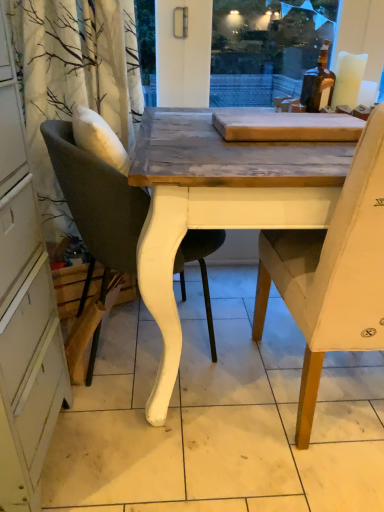
Question: From the image's perspective, is light beige fabric chair at right, which is the first chair from right to left, above or below matte gray cushioned chair at left, the first chair when ordered from left to right?

Choices:
 (A) below
 (B) above

Answer: (A)

Question: Is light beige fabric chair at right, which appears as the 2th chair when viewed from the left, in front of or behind matte gray cushioned chair at left, the second chair viewed from the right, in the image?

Choices:
 (A) behind
 (B) front

Answer: (B)

Question: In terms of size, does light beige fabric chair at right, which appears as the 2th chair when viewed from the left, appear bigger or smaller than matte gray cushioned chair at left, the second chair viewed from the right?

Choices:
 (A) big
 (B) small

Answer: (A)

Question: Based on their sizes in the image, would you say matte gray cushioned chair at left, the first chair when ordered from left to right, is bigger or smaller than light beige fabric chair at right, which appears as the 2th chair when viewed from the left?

Choices:
 (A) small
 (B) big

Answer: (A)

Question: Is matte gray cushioned chair at left, the first chair when ordered from left to right, in front of or behind light beige fabric chair at right, which appears as the 2th chair when viewed from the left, in the image?

Choices:
 (A) front
 (B) behind

Answer: (B)

Question: Considering the positions of matte gray cushioned chair at left, the second chair viewed from the right, and light beige fabric chair at right, which appears as the 2th chair when viewed from the left, in the image, is matte gray cushioned chair at left, the second chair viewed from the right, wider or thinner than light beige fabric chair at right, which appears as the 2th chair when viewed from the left,?

Choices:
 (A) wide
 (B) thin

Answer: (B)

Question: Is point (119, 264) closer or farther from the camera than point (357, 194)?

Choices:
 (A) closer
 (B) farther

Answer: (B)